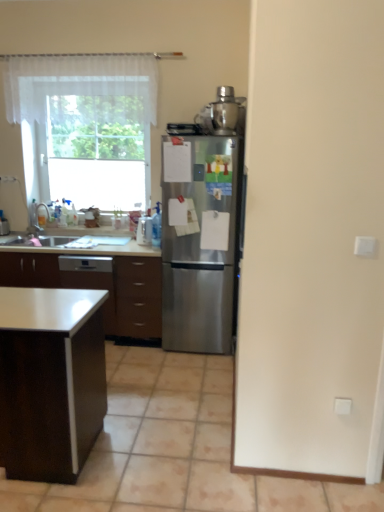
Question: Should I look upward or downward to see satin silver blender at upper right, marked as the 2th appliance in a back-to-front arrangement?

Choices:
 (A) up
 (B) down

Answer: (A)

Question: Is white glossy table at lower left thinner than brushed metal faucet at left?

Choices:
 (A) yes
 (B) no

Answer: (B)

Question: Considering the relative sizes of white glossy table at lower left and brushed metal faucet at left in the image provided, is white glossy table at lower left bigger than brushed metal faucet at left?

Choices:
 (A) yes
 (B) no

Answer: (A)

Question: Is white glossy table at lower left positioned with its back to brushed metal faucet at left?

Choices:
 (A) yes
 (B) no

Answer: (B)

Question: From the image's perspective, is white glossy table at lower left above brushed metal faucet at left?

Choices:
 (A) no
 (B) yes

Answer: (A)

Question: From a real-world perspective, does white glossy table at lower left sit lower than brushed metal faucet at left?

Choices:
 (A) no
 (B) yes

Answer: (B)

Question: From the image's perspective, is white glossy table at lower left below brushed metal faucet at left?

Choices:
 (A) no
 (B) yes

Answer: (B)

Question: Can you confirm if clear plastic spray bottle at center, which ranks as the 2th appliance in right-to-left order, is smaller than white plastic electric outlet at lower right?

Choices:
 (A) no
 (B) yes

Answer: (A)

Question: Does clear plastic spray bottle at center, placed as the 2th appliance when sorted from top to bottom, have a greater height compared to white plastic electric outlet at lower right?

Choices:
 (A) no
 (B) yes

Answer: (B)

Question: Is clear plastic spray bottle at center, which ranks as the 2th appliance in right-to-left order, located outside white plastic electric outlet at lower right?

Choices:
 (A) no
 (B) yes

Answer: (B)

Question: Can you confirm if clear plastic spray bottle at center, the 1th appliance in the back-to-front sequence, is bigger than white plastic electric outlet at lower right?

Choices:
 (A) no
 (B) yes

Answer: (B)

Question: Is clear plastic spray bottle at center, acting as the second appliance starting from the front, shorter than white plastic electric outlet at lower right?

Choices:
 (A) yes
 (B) no

Answer: (B)

Question: Is clear plastic spray bottle at center, the 1th appliance in the back-to-front sequence, behind white plastic electric outlet at lower right?

Choices:
 (A) yes
 (B) no

Answer: (A)

Question: Does satin silver blender at upper right, positioned as the first appliance in top-to-bottom order, have a smaller size compared to brushed metal faucet at left?

Choices:
 (A) yes
 (B) no

Answer: (B)